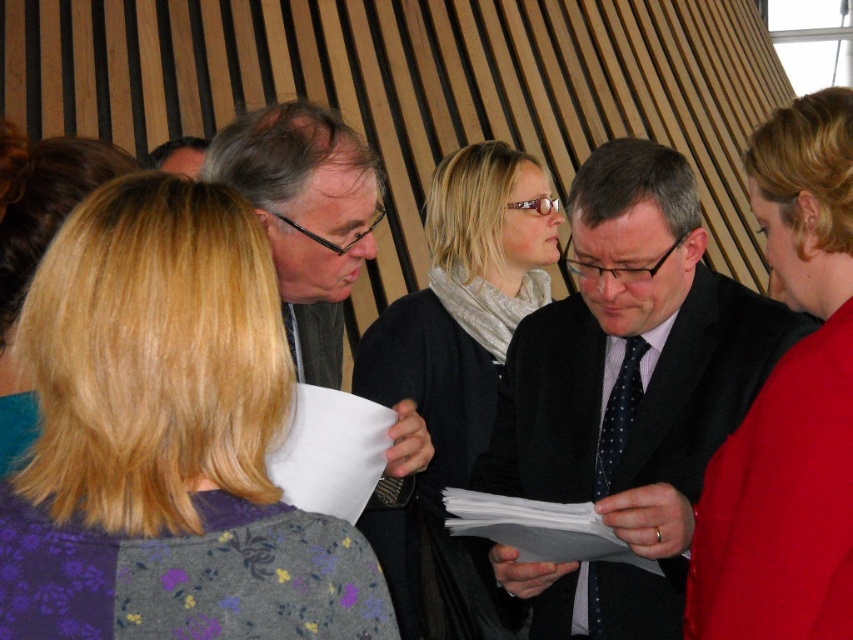
You are a photographer trying to capture a clear shot of the dark blue dotted tie at center without the silver metallic scarf at center blocking it. What should you do?

The silver metallic scarf at center is in front of the dark blue dotted tie at center, so you should move the silver metallic scarf at center out of the way or adjust your angle to avoid obstruction.

In the scene shown: What object is located at the coordinates point (456, 378) in the image?

The silver metallic scarf at center is located at the coordinates point (456, 378).

You are a photographer standing at the back of the room. You want to take a photo of the silver metallic scarf at center and the dark blue dotted tie at center so that both are clearly visible in the frame. Given that your camera has a minimum focus distance of 60 centimeters, will you be able to capture both objects clearly?

The silver metallic scarf at center is 68.21 centimeters away from the dark blue dotted tie at center. Since the minimum focus distance of your camera is 60 centimeters, you can capture both objects clearly as the distance between them is greater than the required minimum focus distance.